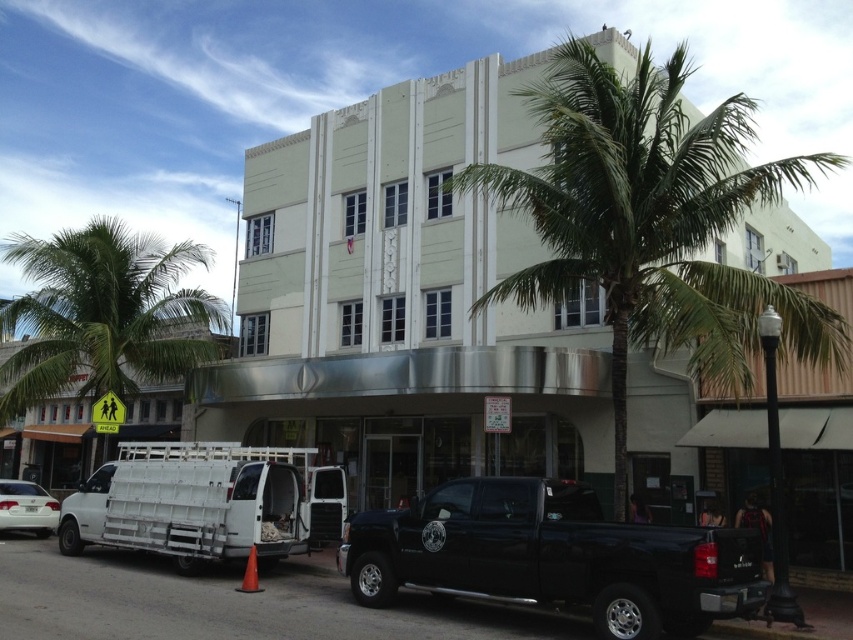
You are standing at the curb in front of the building and want to cross the street to the other side. The crosswalk is 30 feet away. Can you safely reach the crosswalk before the black glossy truck at lower right starts moving?

The black glossy truck at lower right is 25.30 feet away from you. Since the crosswalk is 30 feet away, you can safely reach the crosswalk before the truck starts moving because the distance to the crosswalk is farther than your distance to the truck.